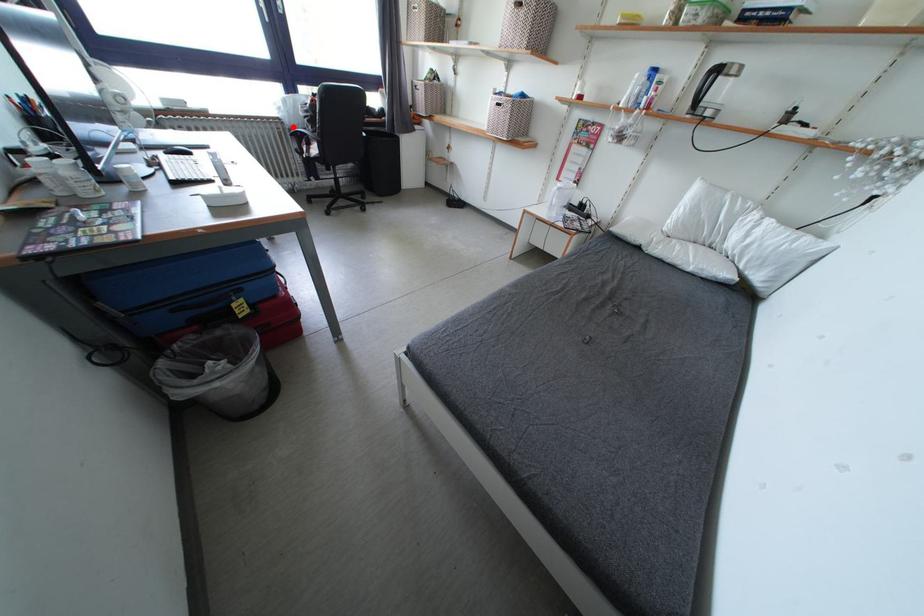
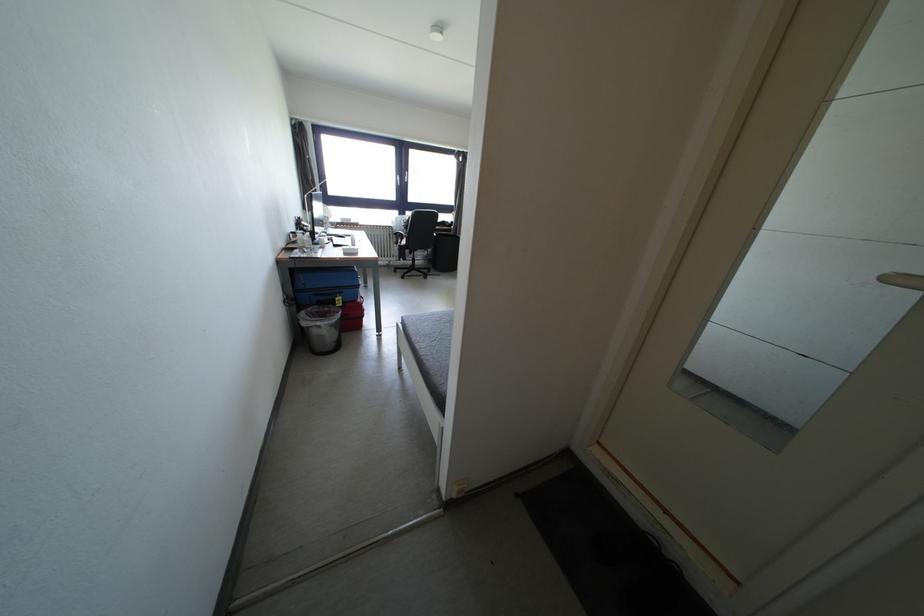
The point at the highlighted location is marked in the first image. Where is the corresponding point in the second image?

(400, 233)